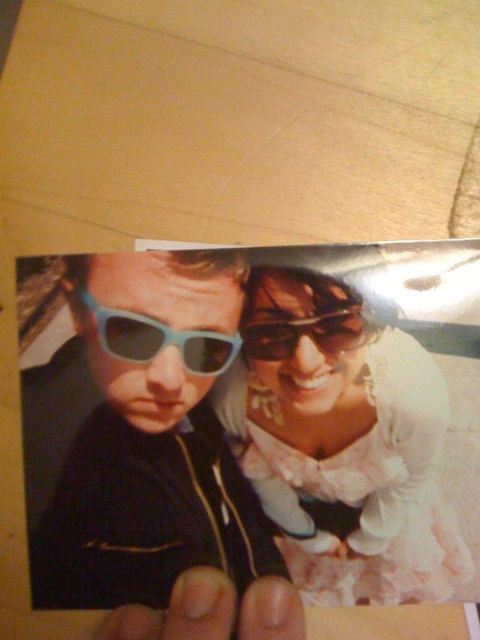
The height and width of the screenshot is (640, 480). I want to click on matte white dress at center, so click(342, 442).

Based on the photo, who is positioned more to the right, matte white dress at center or matte plastic sunglasses at upper center?

From the viewer's perspective, matte white dress at center appears more on the right side.

Where is `matte white dress at center`? This screenshot has height=640, width=480. matte white dress at center is located at coordinates (342, 442).

Is matte plastic sunglasses at left shorter than matte plastic sunglasses at upper center?

Incorrect, matte plastic sunglasses at left's height does not fall short of matte plastic sunglasses at upper center's.

Is matte plastic sunglasses at left below matte plastic sunglasses at upper center?

Yes, matte plastic sunglasses at left is below matte plastic sunglasses at upper center.

Does point (224, 540) come closer to viewer compared to point (280, 346)?

Yes, point (224, 540) is closer to viewer.

Identify the location of matte plastic sunglasses at left. This screenshot has height=640, width=480. (149, 458).

Is nail at lower center smaller than teal plastic goggles at center?

No, nail at lower center is not smaller than teal plastic goggles at center.

Consider the image. Between nail at lower center and teal plastic goggles at center, which one is positioned lower?

nail at lower center is lower down.

Locate an element on the screen. The height and width of the screenshot is (640, 480). nail at lower center is located at coordinates (213, 611).